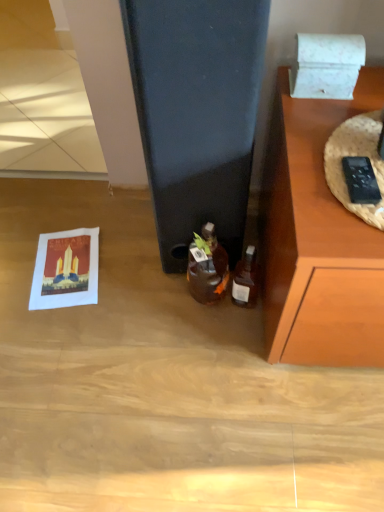
Find the location of a particular element. This screenshot has height=512, width=384. free space to the left of translucent glass bottle at center, marked as the second bottle in a right-to-left arrangement is located at coordinates (148, 303).